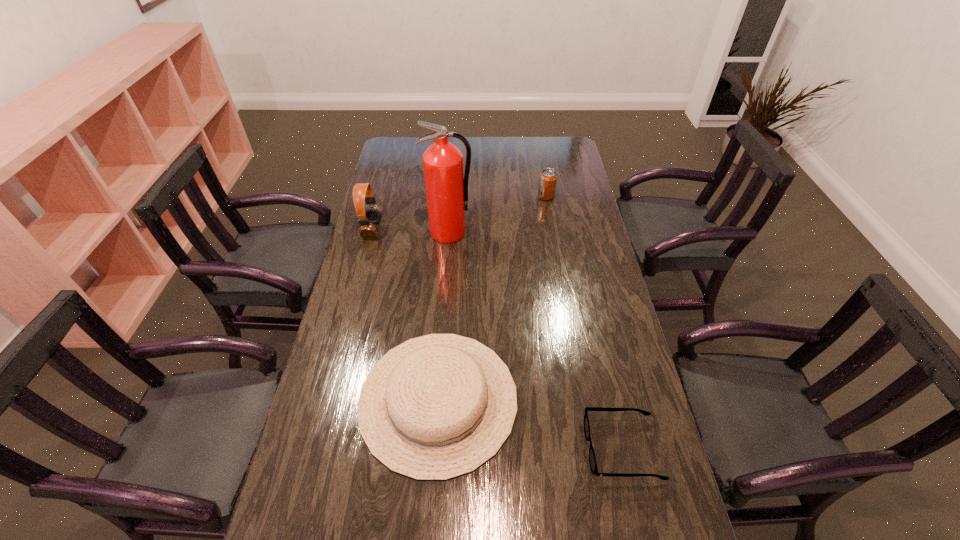
Identify the location of vacant space that satisfies the following two spatial constraints: 1. at the nozzle of the sunhat; 2. on the right side of the tallest object. Image resolution: width=960 pixels, height=540 pixels. (437, 400).

Where is `vacant space that satisfies the following two spatial constraints: 1. at the nozzle of the tallest object; 2. on the left side of the fourth tallest object`? The image size is (960, 540). vacant space that satisfies the following two spatial constraints: 1. at the nozzle of the tallest object; 2. on the left side of the fourth tallest object is located at coordinates (437, 400).

Image resolution: width=960 pixels, height=540 pixels. Identify the location of free spot that satisfies the following two spatial constraints: 1. on the ear cups of the second tallest object; 2. on the right side of the sunhat. (327, 400).

The height and width of the screenshot is (540, 960). I want to click on vacant position in the image that satisfies the following two spatial constraints: 1. on the back side of the sunhat; 2. on the right side of the farthest object, so click(453, 197).

Find the location of `vacant space that satisfies the following two spatial constraints: 1. on the ear cups of the second shortest object; 2. on the left side of the second tallest object`. vacant space that satisfies the following two spatial constraints: 1. on the ear cups of the second shortest object; 2. on the left side of the second tallest object is located at coordinates (327, 400).